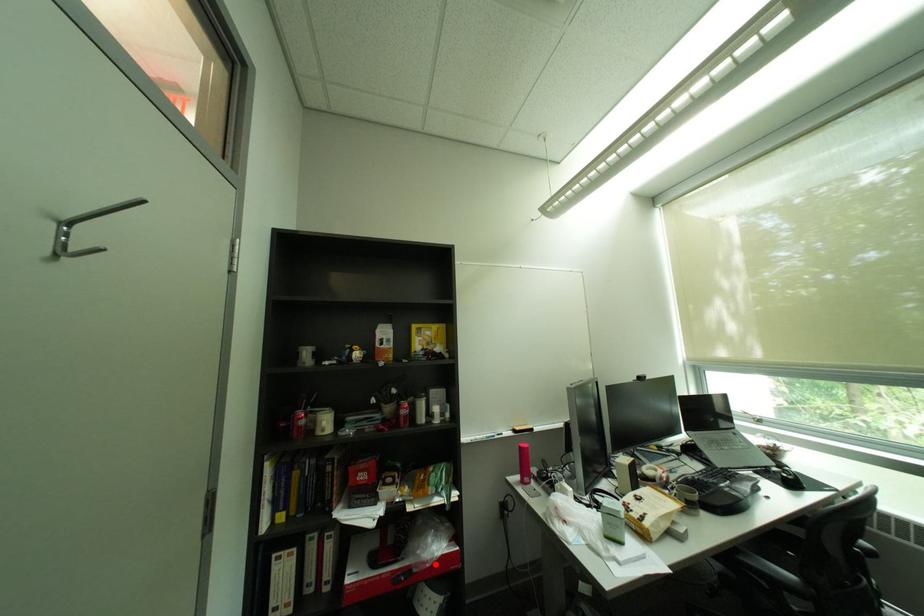
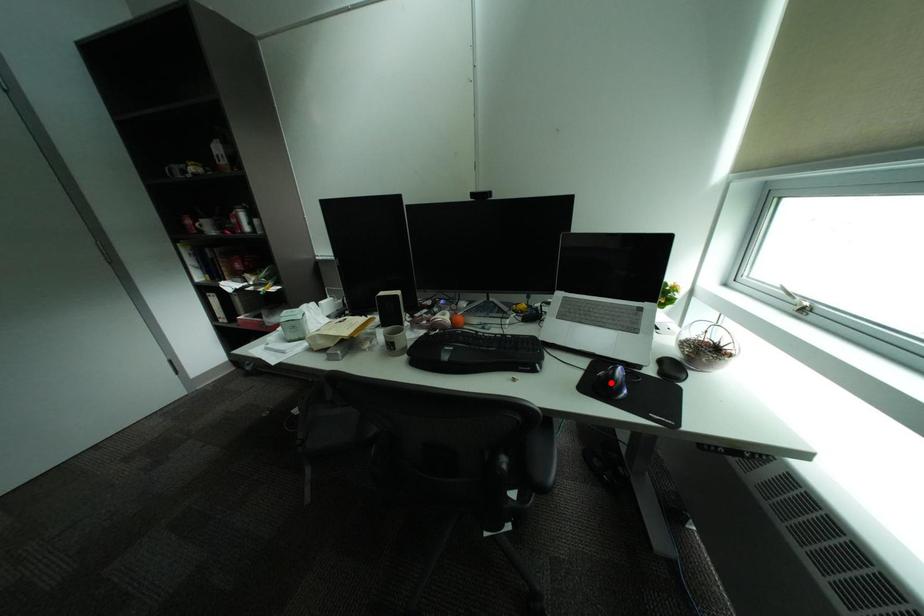
I am providing you with two images of the same scene from different viewpoints. A red point is marked on the first image and another point is marked on the second image. Are the points marked in image1 and image2 representing the same 3D position?

No